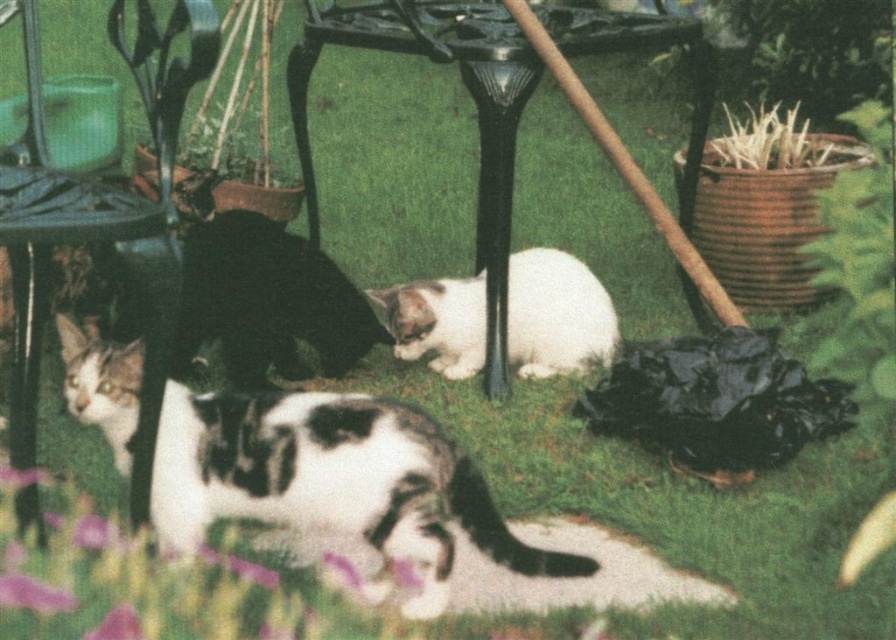
You are a photographer setting up a tripod in the center of the scene. You need to place the tripod so that it doesn not block either the white fur cat at center or the metallic black chair at center. Given their sizes, which object should you position the tripod closer to?

The white fur cat at center occupies less space than the metallic black chair at center, so positioning the tripod closer to the white fur cat at center would be better to avoid blocking either object.

You are standing in the outdoor scene and want to place a small toy between the two points, point (x=352, y=467) and point (x=455, y=374). Which point should the toy be closer to if you want it to appear larger in the camera view?

The toy should be placed closer to point (x=352, y=467) because it is closer to the camera than point (x=455, y=374), so objects near it will appear larger in the camera view.

You are a photographer setting up a tripod to capture the scene with the white fur cat at center and the white soft fur cat at center. Which cat should you focus on if you want to photograph the taller one?

The white fur cat at center is much taller than the white soft fur cat at center, so you should focus on the white fur cat at center.